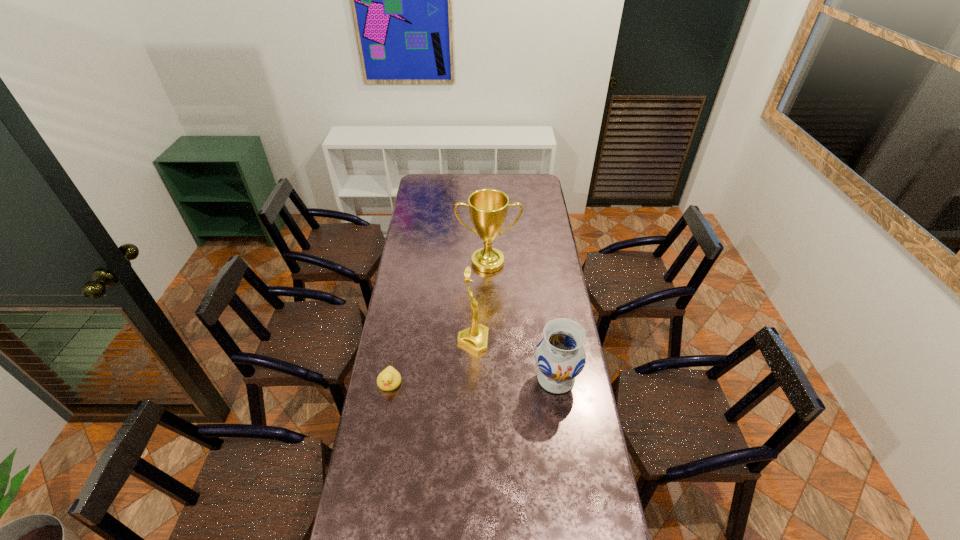
Where is `the nearer award`? the nearer award is located at coordinates (475, 338).

Where is `the farther award`? the farther award is located at coordinates (488, 208).

Locate an element on the screen. This screenshot has height=540, width=960. the third tallest object is located at coordinates (560, 356).

Where is `the rightmost object`? Image resolution: width=960 pixels, height=540 pixels. the rightmost object is located at coordinates (560, 356).

Identify the location of the shortest object. (389, 379).

This screenshot has height=540, width=960. Identify the location of the leftmost object. (x=389, y=379).

At what (x,y) coordinates should I click in order to perform the action: click on free point located on the front-facing side of the nearer award. Please return your answer as a coordinate pair (x, y). Looking at the image, I should click on (514, 341).

Identify the location of vacant space located 0.220m by the handles of the farther award. The width and height of the screenshot is (960, 540). (489, 307).

Locate an element on the screen. free space located on the front of the second shortest object is located at coordinates 564,429.

Find the location of a particular element. blank space located on the face of the duckling is located at coordinates (372, 483).